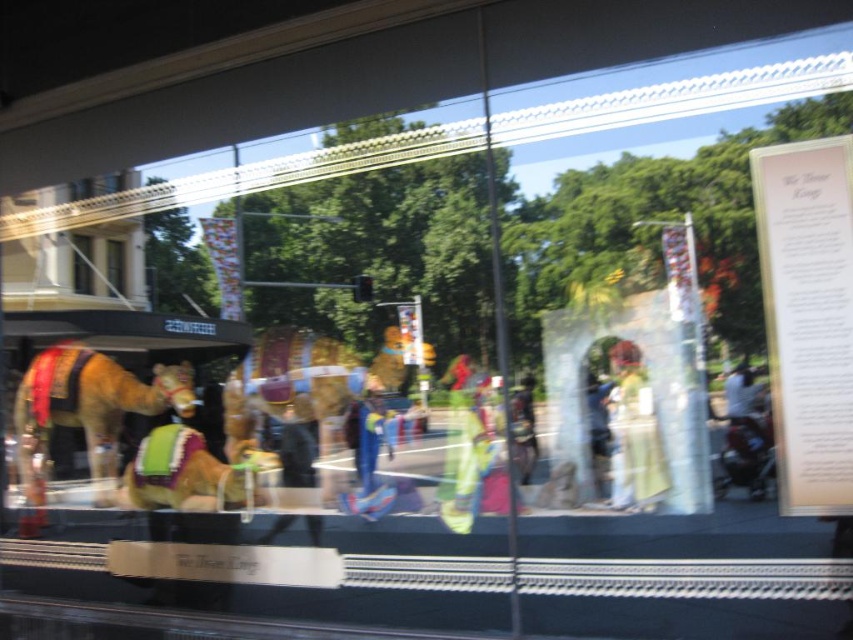
You are an artist holding a pencil and want to sketch the blue denim jeans at center and the white paper at upper right. Which object should you focus on first if you want to capture the wider object in the scene?

The white paper at upper right is wider than the blue denim jeans at center, so you should focus on the white paper at upper right first to capture the wider object.

You are standing inside a building looking out through a large glass window. You notice a point marked at coordinates (82, 264). What object does this point correspond to?

The point at coordinates (82, 264) corresponds to the matte brown camel at left.

You are standing inside the building and looking out through the large glass window. You see the matte brown camel at left. Can you determine if the camel is positioned closer to the left edge or the right edge of the window?

The matte brown camel at left is located at point 0.414 on the x and y axis, so it is closer to the left edge of the window.